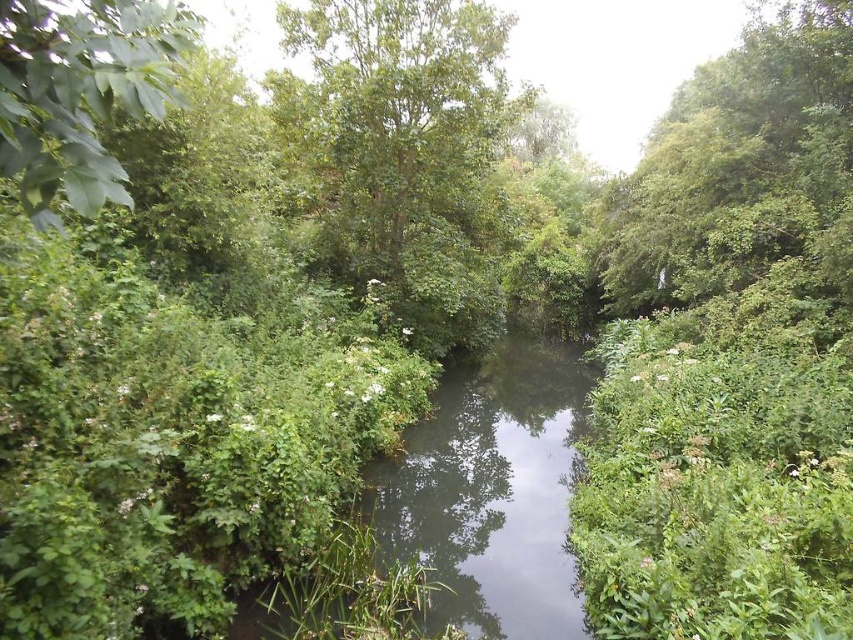
Between point (498, 552) and point (138, 52), which one is positioned behind?

Point (498, 552)

Does clear water at center appear on the right side of green leafy tree at upper left?

Correct, you'll find clear water at center to the right of green leafy tree at upper left.

Does point (577, 412) lie behind point (142, 20)?

Yes, it is behind point (142, 20).

Find the location of a particular element. The height and width of the screenshot is (640, 853). clear water at center is located at coordinates (490, 492).

Can you confirm if green leafy tree at center is taller than green leafy tree at upper left?

In fact, green leafy tree at center may be shorter than green leafy tree at upper left.

Which is above, green leafy tree at center or green leafy tree at upper left?

green leafy tree at center is above.

Does point (454, 163) lie in front of point (71, 10)?

No, it is not.

The image size is (853, 640). What are the coordinates of `green leafy tree at center` in the screenshot? It's located at (407, 148).

Can you confirm if green leafy tree at center is positioned to the left of clear water at center?

Correct, you'll find green leafy tree at center to the left of clear water at center.

Can you confirm if green leafy tree at center is bigger than clear water at center?

No, green leafy tree at center is not bigger than clear water at center.

What do you see at coordinates (407, 148) in the screenshot?
I see `green leafy tree at center` at bounding box center [407, 148].

The width and height of the screenshot is (853, 640). Find the location of `green leafy tree at center`. green leafy tree at center is located at coordinates [x=407, y=148].